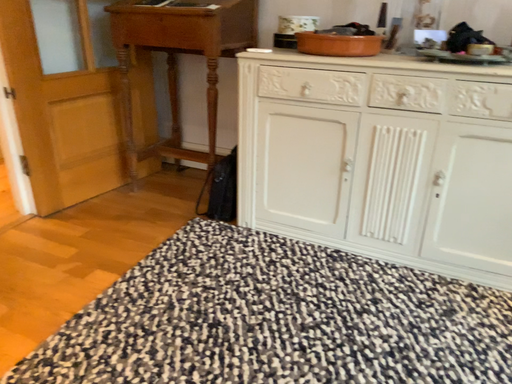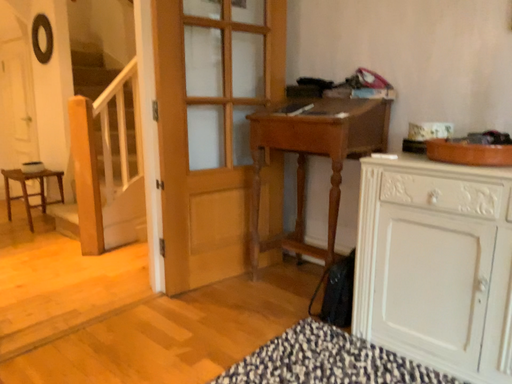
Question: Which way did the camera rotate in the video?

Choices:
 (A) rotated upward
 (B) rotated downward

Answer: (A)